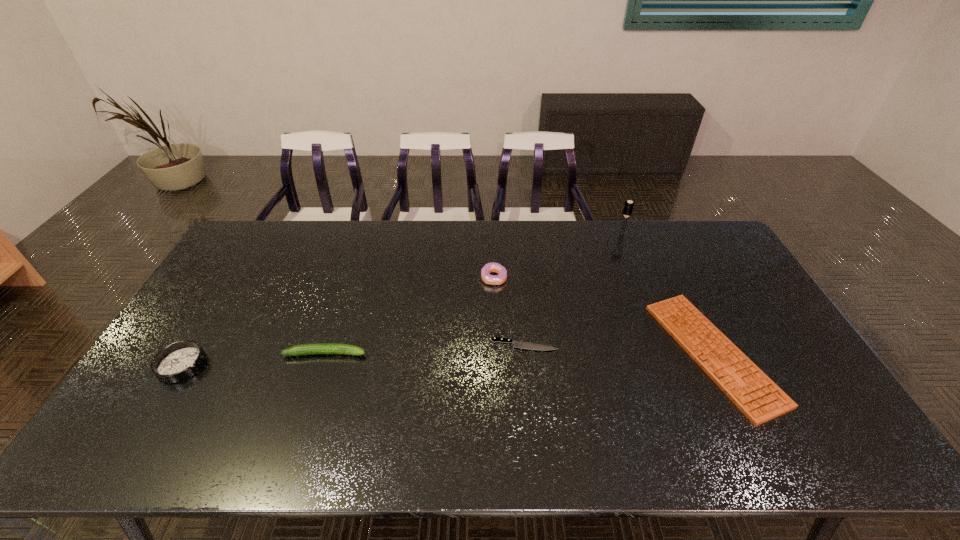
At what (x,y) coordinates should I click in order to perform the action: click on vacant space located 0.130m on the front-facing side of the second object from left to right. Please return your answer as a coordinate pair (x, y). The height and width of the screenshot is (540, 960). Looking at the image, I should click on (413, 353).

You are a GUI agent. You are given a task and a screenshot of the screen. Output one action in this format:
    pyautogui.click(x=<x>, y=<y>)
    Task: Click on the free region located on the left of the second shortest object
    
    Given the screenshot: What is the action you would take?
    pyautogui.click(x=552, y=353)

Where is `vacant space situated 0.100m on the right of the steak knife`? The width and height of the screenshot is (960, 540). vacant space situated 0.100m on the right of the steak knife is located at coordinates (593, 345).

Image resolution: width=960 pixels, height=540 pixels. I want to click on object that is at the far edge, so click(628, 207).

Identify the location of object positioned at the near edge. Image resolution: width=960 pixels, height=540 pixels. (746, 385).

Where is `object at the left edge`? Image resolution: width=960 pixels, height=540 pixels. object at the left edge is located at coordinates (178, 361).

Find the location of a particular element. The width and height of the screenshot is (960, 540). object that is at the right edge is located at coordinates pos(746,385).

This screenshot has width=960, height=540. In order to click on object located in the near right corner section of the desktop in this screenshot , I will do `click(746, 385)`.

Find the location of `vacant area at the far edge of the desktop`. vacant area at the far edge of the desktop is located at coordinates (530, 258).

In order to click on free space at the near edge of the desktop in this screenshot , I will do (x=501, y=455).